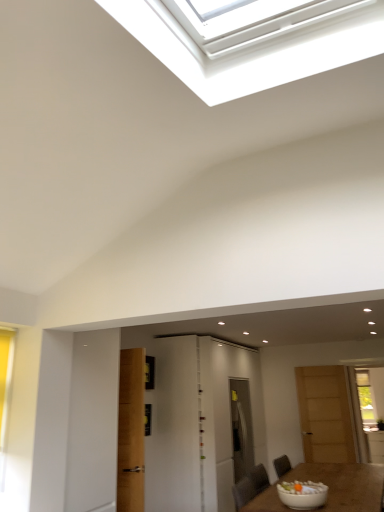
Question: Which direction should I rotate to face white glossy door at center, placed as the 2th door when sorted from left to right, — up or down?

Choices:
 (A) up
 (B) down

Answer: (B)

Question: Is white glossy bowl at lower right positioned with its back to white glossy door at center, which is counted as the 1th door, starting from the left?

Choices:
 (A) yes
 (B) no

Answer: (B)

Question: Are white glossy bowl at lower right and white glossy door at center, which is counted as the 1th door, starting from the left, located far from each other?

Choices:
 (A) yes
 (B) no

Answer: (A)

Question: Considering the relative sizes of white glossy bowl at lower right and white glossy door at center, which is counted as the 3th door, starting from the right, in the image provided, is white glossy bowl at lower right bigger than white glossy door at center, which is counted as the 3th door, starting from the right,?

Choices:
 (A) yes
 (B) no

Answer: (B)

Question: Is white glossy bowl at lower right to the left of white glossy door at center, which is counted as the 1th door, starting from the left, from the viewer's perspective?

Choices:
 (A) yes
 (B) no

Answer: (B)

Question: Is white glossy bowl at lower right facing towards white glossy door at center, which is counted as the 3th door, starting from the right?

Choices:
 (A) no
 (B) yes

Answer: (A)

Question: Can you confirm if white glossy bowl at lower right is taller than white glossy door at center, which is counted as the 1th door, starting from the left?

Choices:
 (A) no
 (B) yes

Answer: (A)

Question: Is white glossy bowl at lower right positioned with its back to white glossy door at center, marked as the second door in a right-to-left arrangement?

Choices:
 (A) no
 (B) yes

Answer: (A)

Question: Is white glossy bowl at lower right closer to camera compared to white glossy door at center, placed as the 2th door when sorted from left to right?

Choices:
 (A) no
 (B) yes

Answer: (B)

Question: Is white glossy bowl at lower right outside white glossy door at center, placed as the 2th door when sorted from left to right?

Choices:
 (A) yes
 (B) no

Answer: (A)

Question: Considering the relative sizes of white glossy bowl at lower right and white glossy door at center, marked as the second door in a right-to-left arrangement, in the image provided, is white glossy bowl at lower right smaller than white glossy door at center, marked as the second door in a right-to-left arrangement,?

Choices:
 (A) yes
 (B) no

Answer: (A)

Question: Does white glossy bowl at lower right have a lesser height compared to white glossy door at center, placed as the 2th door when sorted from left to right?

Choices:
 (A) yes
 (B) no

Answer: (A)

Question: Is white glossy bowl at lower right oriented towards white glossy door at center, placed as the 2th door when sorted from left to right?

Choices:
 (A) no
 (B) yes

Answer: (A)

Question: Is white glossy door at center, which is counted as the 3th door, starting from the right, to the right of white glossy bowl at lower right from the viewer's perspective?

Choices:
 (A) no
 (B) yes

Answer: (A)